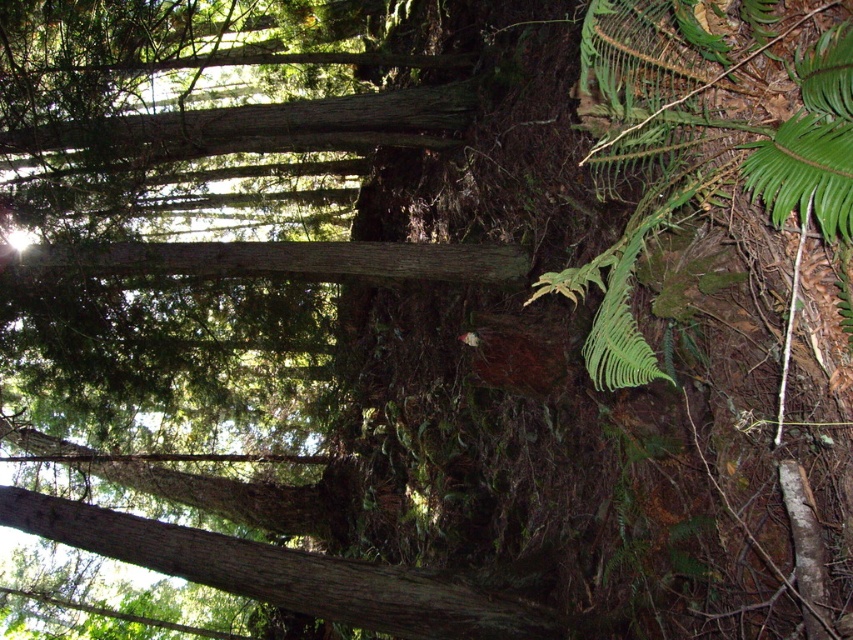
Measure the distance from green leafy fern at lower right to smooth brown log at center.

They are 9.69 feet apart.

Is green leafy fern at lower right to the left of smooth brown log at center from the viewer's perspective?

In fact, green leafy fern at lower right is to the right of smooth brown log at center.

I want to click on green leafy fern at lower right, so click(700, 145).